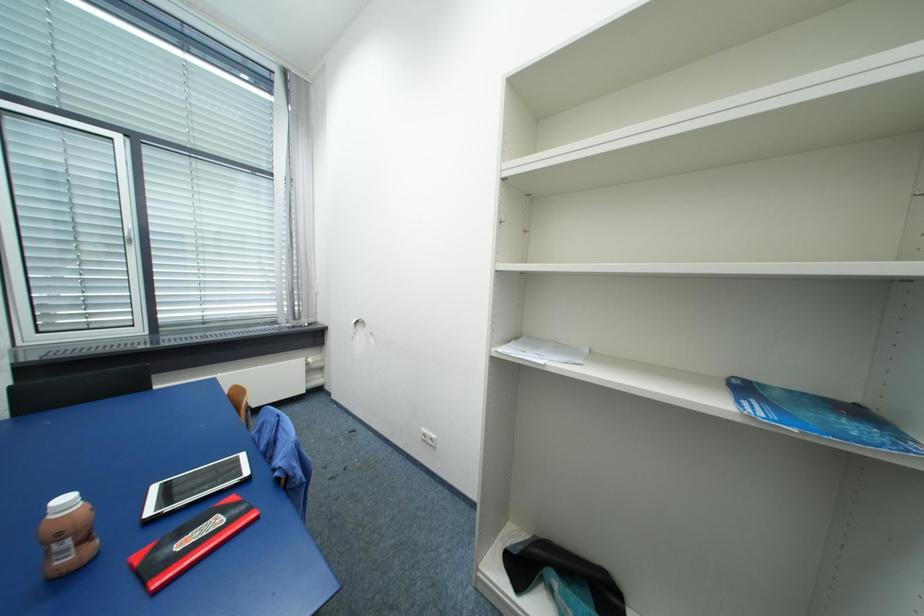
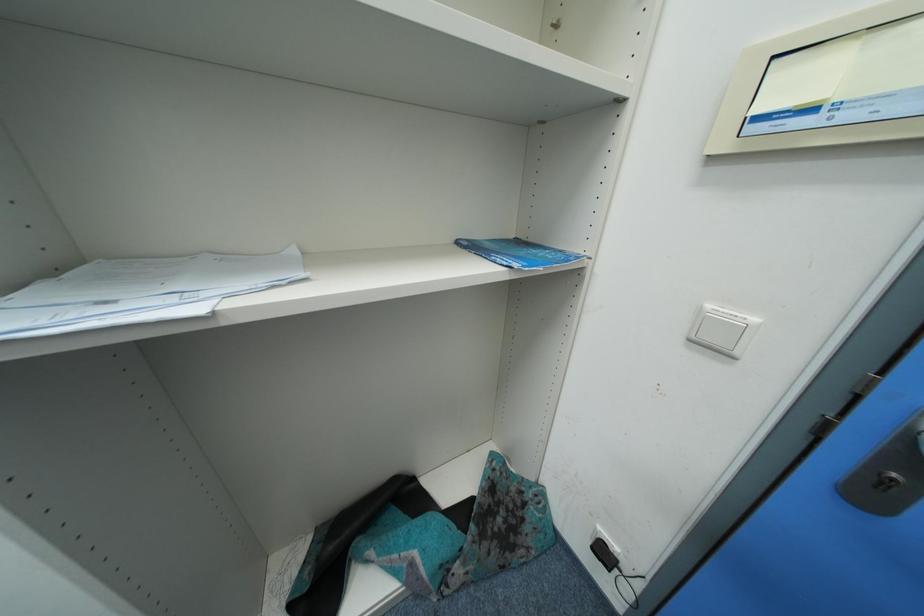
First-person continuous shooting, in which direction is the camera rotating?

The camera's rotation is toward right-down.